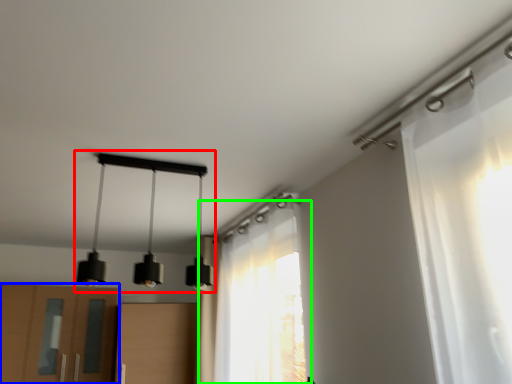
Question: Based on their relative distances, which object is farther from lamp (highlighted by a red box)? Choose from cabinetry (highlighted by a blue box) and curtain (highlighted by a green box).

Choices:
 (A) cabinetry
 (B) curtain

Answer: (B)